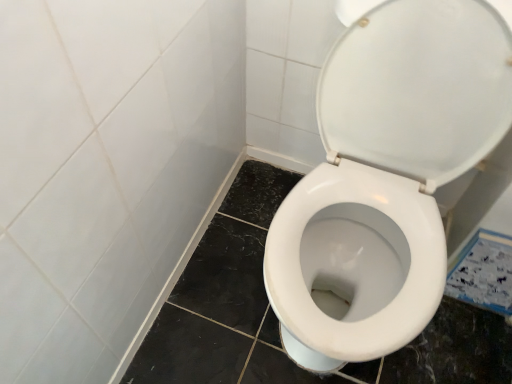
Find the location of `white glossy ceramic tile at lower right`. white glossy ceramic tile at lower right is located at coordinates (483, 273).

What do you see at coordinates (483, 273) in the screenshot? I see `white glossy ceramic tile at lower right` at bounding box center [483, 273].

Looking at this image, measure the distance between white glossy ceramic tile at lower right and camera.

3.37 feet.

At what (x,y) coordinates should I click in order to perform the action: click on white glossy toilet at center. Please return your answer as a coordinate pair (x, y). Looking at the image, I should click on (385, 177).

This screenshot has width=512, height=384. What do you see at coordinates (385, 177) in the screenshot?
I see `white glossy toilet at center` at bounding box center [385, 177].

At what (x,y) coordinates should I click in order to perform the action: click on white glossy ceramic tile at lower right. Please return your answer as a coordinate pair (x, y). Looking at the image, I should click on [x=483, y=273].

Between white glossy ceramic tile at lower right and white glossy toilet at center, which one appears on the left side from the viewer's perspective?

Positioned to the left is white glossy toilet at center.

Which object is further away from the camera, white glossy ceramic tile at lower right or white glossy toilet at center?

white glossy ceramic tile at lower right is behind.

Which is in front, point (451, 276) or point (342, 173)?

Point (342, 173)

From the image's perspective, who appears lower, white glossy ceramic tile at lower right or white glossy toilet at center?

white glossy ceramic tile at lower right appears lower in the image.

From a real-world perspective, which object rests below the other?

white glossy ceramic tile at lower right, from a real-world perspective.

Which of these two, white glossy ceramic tile at lower right or white glossy toilet at center, is wider?

Wider between the two is white glossy toilet at center.

Who is taller, white glossy ceramic tile at lower right or white glossy toilet at center?

Standing taller between the two is white glossy toilet at center.

Is white glossy ceramic tile at lower right bigger than white glossy toilet at center?

Incorrect, white glossy ceramic tile at lower right is not larger than white glossy toilet at center.

Would you say white glossy ceramic tile at lower right contains white glossy toilet at center?

No, white glossy toilet at center is not surrounded by white glossy ceramic tile at lower right.

Are white glossy ceramic tile at lower right and white glossy toilet at center located far from each other?

Actually, white glossy ceramic tile at lower right and white glossy toilet at center are a little close together.

Is white glossy ceramic tile at lower right facing away from white glossy toilet at center?

No, white glossy toilet at center is not at the back of white glossy ceramic tile at lower right.

Measure the distance between white glossy ceramic tile at lower right and white glossy toilet at center.

They are 14.79 inches apart.

Where is `ceramic tile below the white glossy toilet at center (from the image's perspective)`? ceramic tile below the white glossy toilet at center (from the image's perspective) is located at coordinates (483, 273).

Can you confirm if white glossy toilet at center is positioned to the left of white glossy ceramic tile at lower right?

Yes, white glossy toilet at center is to the left of white glossy ceramic tile at lower right.

Considering the positions of objects white glossy toilet at center and white glossy ceramic tile at lower right in the image provided, who is behind, white glossy toilet at center or white glossy ceramic tile at lower right?

white glossy ceramic tile at lower right is more distant.

Does point (302, 313) come in front of point (482, 306)?

That is True.

From the image's perspective, is white glossy toilet at center located beneath white glossy ceramic tile at lower right?

No.

From a real-world perspective, is white glossy toilet at center positioned under white glossy ceramic tile at lower right based on gravity?

No, from a real-world perspective, white glossy toilet at center is not below white glossy ceramic tile at lower right.

Considering the relative sizes of white glossy toilet at center and white glossy ceramic tile at lower right in the image provided, is white glossy toilet at center thinner than white glossy ceramic tile at lower right?

No, white glossy toilet at center is not thinner than white glossy ceramic tile at lower right.

Does white glossy toilet at center have a lesser height compared to white glossy ceramic tile at lower right?

Incorrect, the height of white glossy toilet at center does not fall short of that of white glossy ceramic tile at lower right.

Considering the sizes of objects white glossy toilet at center and white glossy ceramic tile at lower right in the image provided, who is smaller, white glossy toilet at center or white glossy ceramic tile at lower right?

Smaller between the two is white glossy ceramic tile at lower right.

Which is correct: white glossy toilet at center is inside white glossy ceramic tile at lower right, or outside of it?

The correct answer is: outside.

Is white glossy toilet at center not near white glossy ceramic tile at lower right?

That's not correct — white glossy toilet at center is a little close to white glossy ceramic tile at lower right.

Is white glossy toilet at center turned away from white glossy ceramic tile at lower right?

No, white glossy toilet at center's orientation is not away from white glossy ceramic tile at lower right.

How many degrees apart are the facing directions of white glossy toilet at center and white glossy ceramic tile at lower right?

There is a 0.351-degree angle between the facing directions of white glossy toilet at center and white glossy ceramic tile at lower right.

Measure the distance from white glossy toilet at center to white glossy ceramic tile at lower right.

A distance of 37.57 centimeters exists between white glossy toilet at center and white glossy ceramic tile at lower right.

I want to click on ceramic tile located on the right of white glossy toilet at center, so click(483, 273).

What are the coordinates of `ceramic tile that appears below the white glossy toilet at center (from the image's perspective)` in the screenshot? It's located at (483, 273).

This screenshot has width=512, height=384. I want to click on toilet that appears above the white glossy ceramic tile at lower right (from a real-world perspective), so click(x=385, y=177).